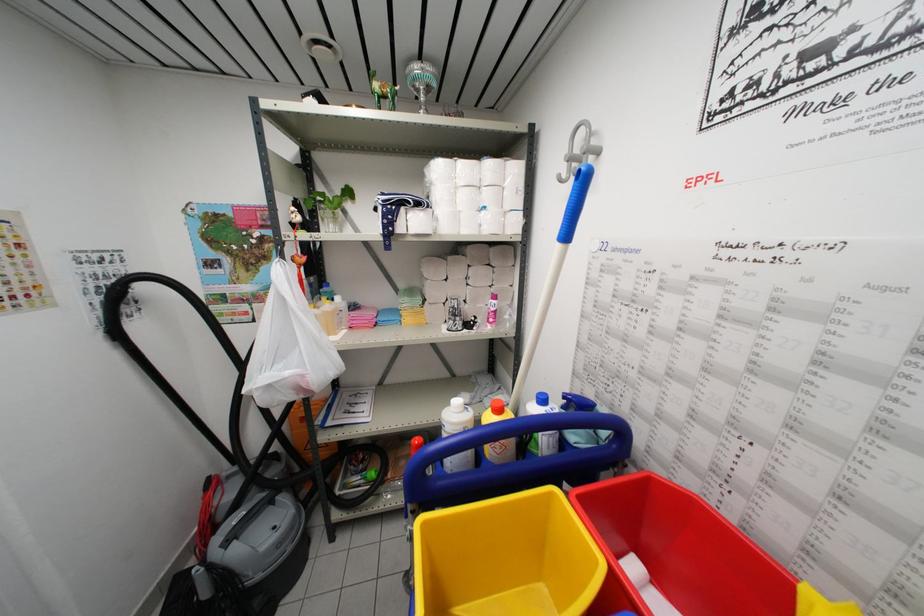
The height and width of the screenshot is (616, 924). What do you see at coordinates (512, 459) in the screenshot? I see `a blue cart handle` at bounding box center [512, 459].